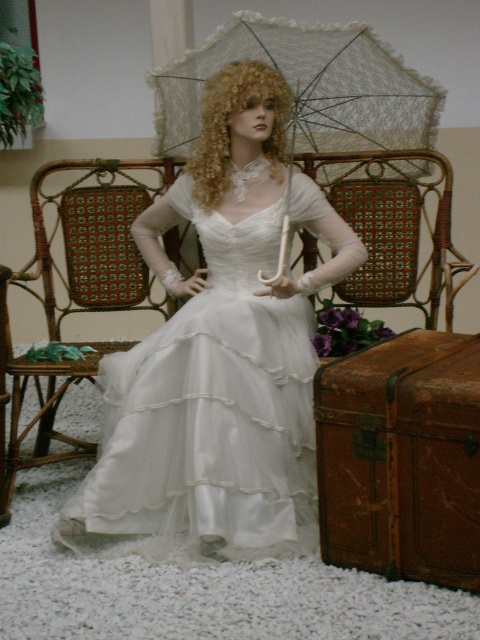
Question: Which object is farther from the camera taking this photo?

Choices:
 (A) woven rattan chair at center
 (B) white lace umbrella at center
 (C) satin dress at center

Answer: (A)

Question: Is woven rattan chair at center below blonde curly wig at center?

Choices:
 (A) yes
 (B) no

Answer: (A)

Question: Which of these objects is positioned closest to the blonde curly wig at center?

Choices:
 (A) woven rattan chair at center
 (B) woven wood chair at center
 (C) white lace umbrella at center
 (D) satin dress at center

Answer: (C)

Question: Estimate the real-world distances between objects in this image. Which object is farther from the blonde curly wig at center?

Choices:
 (A) satin dress at center
 (B) woven rattan chair at center
 (C) woven wood chair at center
 (D) white lace umbrella at center

Answer: (C)

Question: Where is white lace umbrella at center located in relation to woven rattan chair at center in the image?

Choices:
 (A) above
 (B) below

Answer: (A)

Question: Can you confirm if satin dress at center is positioned below woven rattan chair at center?

Choices:
 (A) yes
 (B) no

Answer: (A)